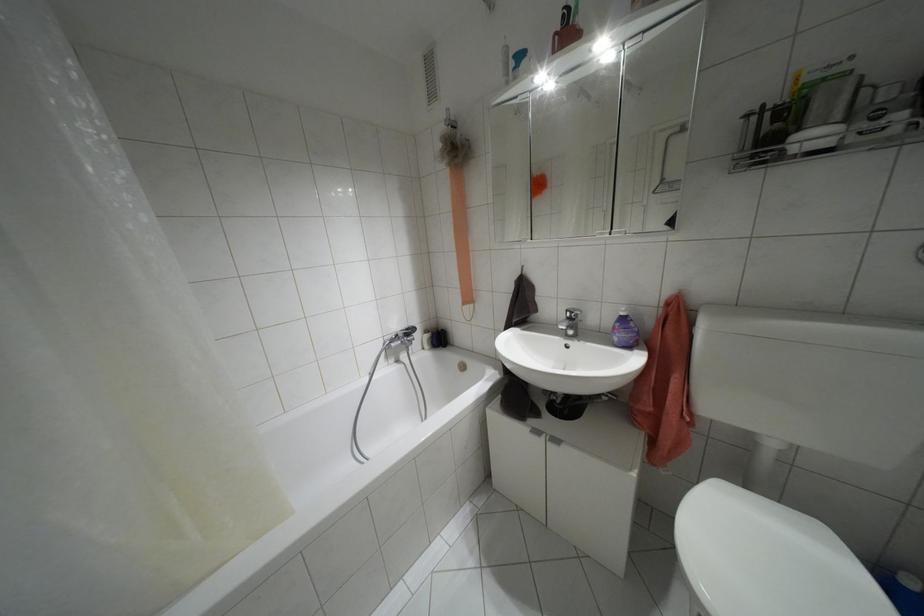
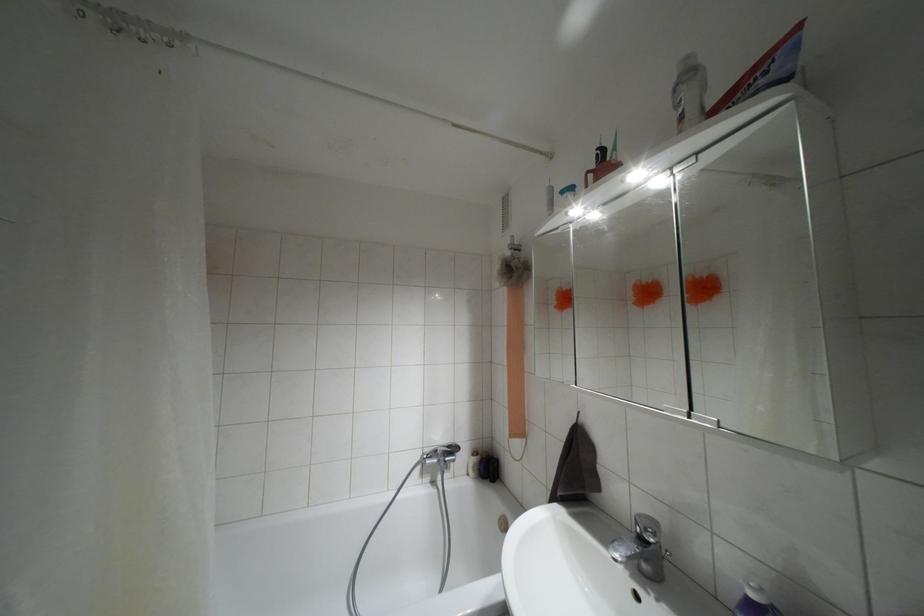
Where in the second image is the point corresponding to [622,313] from the first image?

(751, 594)